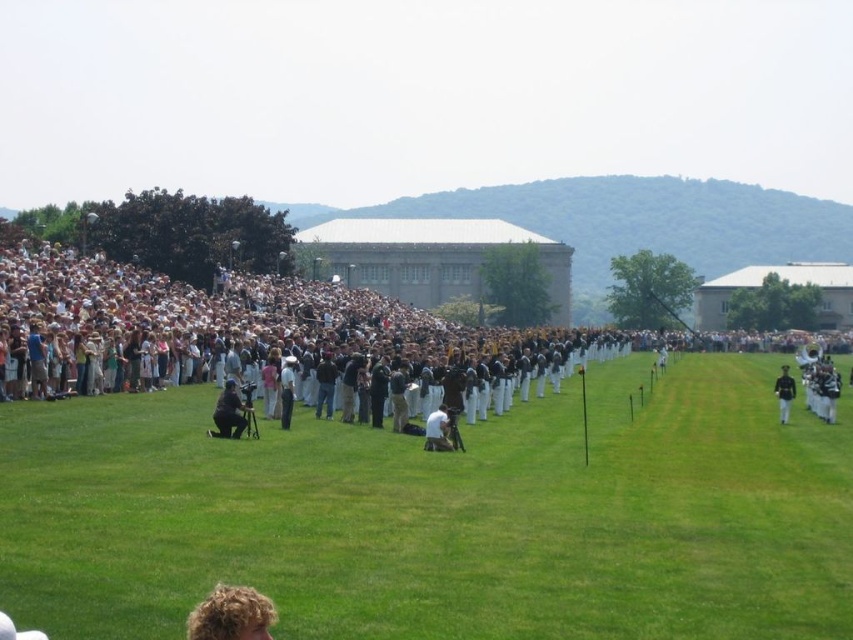
Is point (447, 552) positioned after point (428, 432)?

That is False.

You are a GUI agent. You are given a task and a screenshot of the screen. Output one action in this format:
    pyautogui.click(x=<x>, y=<y>)
    Task: Click on the green grass at center
    The height and width of the screenshot is (640, 853).
    Given the screenshot: What is the action you would take?
    pyautogui.click(x=440, y=516)

Image resolution: width=853 pixels, height=640 pixels. I want to click on green grass at center, so click(440, 516).

Between green grass at center and matte black camera at lower center, which one appears on the left side from the viewer's perspective?

matte black camera at lower center is more to the left.

Which is more to the right, green grass at center or matte black camera at lower center?

From the viewer's perspective, green grass at center appears more on the right side.

In order to click on green grass at center in this screenshot , I will do `click(440, 516)`.

Which is below, curly blonde hair at lower left or dark blue uniform at center?

Positioned lower is curly blonde hair at lower left.

Does curly blonde hair at lower left have a greater width compared to dark blue uniform at center?

Incorrect, curly blonde hair at lower left's width does not surpass dark blue uniform at center's.

Is point (263, 612) less distant than point (787, 397)?

Yes, point (263, 612) is in front of point (787, 397).

You are a GUI agent. You are given a task and a screenshot of the screen. Output one action in this format:
    pyautogui.click(x=<x>, y=<y>)
    Task: Click on the curly blonde hair at lower left
    
    Given the screenshot: What is the action you would take?
    pyautogui.click(x=231, y=614)